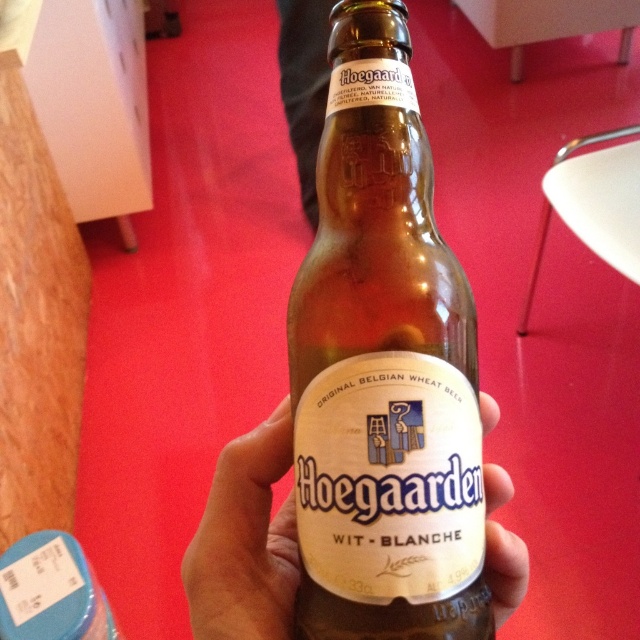
You are a bartender arranging drinks on a shelf. You have a brown glass bottle at center and a translucent glass bottle at center. If you want to place another bottle between them, what is the minimum distance the new bottle should be placed from each existing bottle to fit?

The minimum distance the new bottle should be placed from each existing bottle is 1.75 inches, as the brown glass bottle at center and translucent glass bottle at center are 3.50 inches apart. This allows the new bottle to fit exactly in the middle with equal spacing.

You are organizing a party and have two bottles in front of you. One is a translucent glass bottle at center and the other is a clear glass bottle at center. You need to place them side by side on a shelf that can only accommodate items up to the width of the wider bottle. Which bottle should you use as the reference for the shelf width?

The translucent glass bottle at center is wider than the clear glass bottle at center, so you should use the translucent glass bottle at center as the reference for the shelf width to ensure both bottles fit.

You are looking at the Hoegaarden beer bottle label. There are two points on the label. The first point is at coordinates point (412, 326) and the second point is at point (70, 602). Which point is closer to you?

Point (412, 326) is closer to the viewer than point (70, 602).